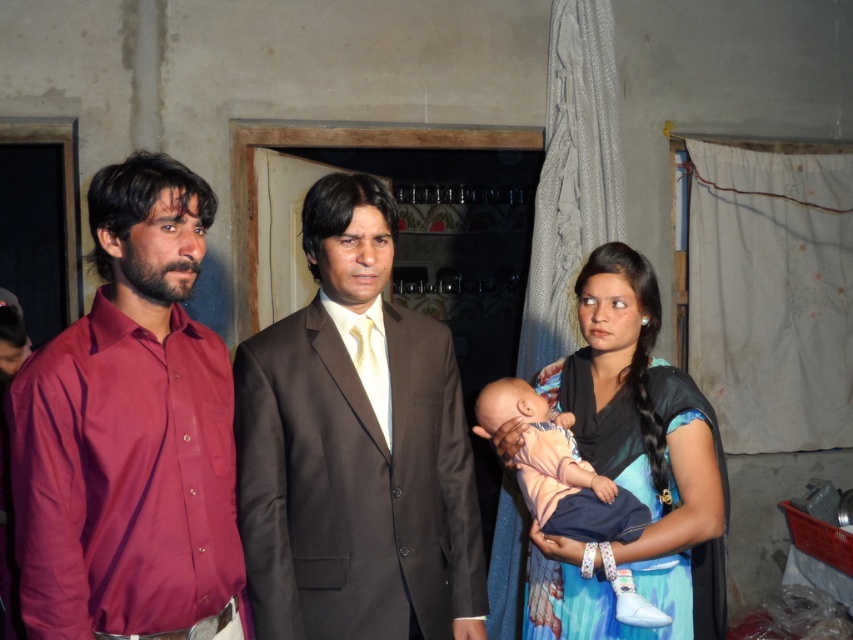
Is point (260, 540) less distant than point (498, 381)?

Yes, point (260, 540) is in front of point (498, 381).

Based on the photo, can you confirm if brown suit at center is positioned to the left of soft pink fabric baby at center?

Correct, you'll find brown suit at center to the left of soft pink fabric baby at center.

Where is `brown suit at center`? Image resolution: width=853 pixels, height=640 pixels. brown suit at center is located at coordinates click(355, 449).

Between point (178, 616) and point (689, 460), which one is positioned behind?

The point (689, 460) is behind.

Can you confirm if matte black suit at center is wider than blue printed sari at right?

Correct, the width of matte black suit at center exceeds that of blue printed sari at right.

The image size is (853, 640). What do you see at coordinates (129, 432) in the screenshot?
I see `matte black suit at center` at bounding box center [129, 432].

Image resolution: width=853 pixels, height=640 pixels. I want to click on matte black suit at center, so click(x=129, y=432).

Between matte black suit at center and brown suit at center, which one appears on the right side from the viewer's perspective?

brown suit at center

This screenshot has width=853, height=640. What do you see at coordinates (129, 432) in the screenshot?
I see `matte black suit at center` at bounding box center [129, 432].

Is point (190, 465) behind point (315, 365)?

No, (190, 465) is closer to viewer.

Find the location of a particular element. Image resolution: width=853 pixels, height=640 pixels. matte black suit at center is located at coordinates point(129,432).